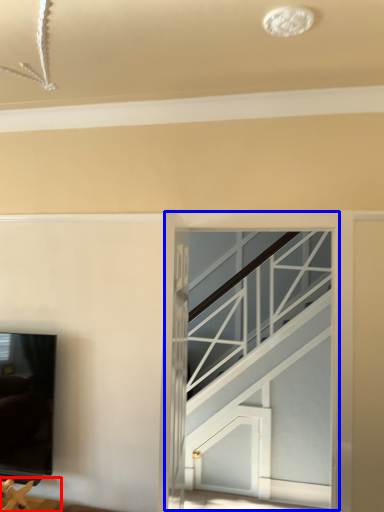
Question: Among these objects, which one is farthest to the camera, furniture (highlighted by a red box) or glass door (highlighted by a blue box)?

Choices:
 (A) furniture
 (B) glass door

Answer: (B)